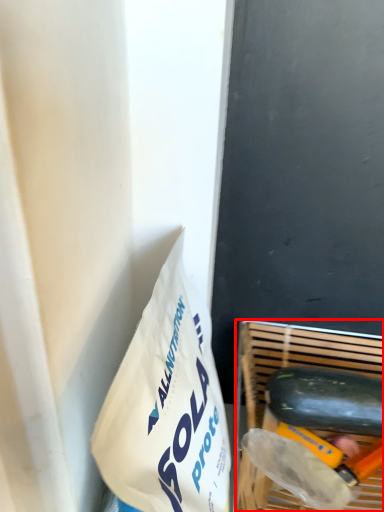
Question: From the image's perspective, considering the relative positions of basket (annotated by the red box) and cucumber in the image provided, where is basket (annotated by the red box) located with respect to the staircase?

Choices:
 (A) above
 (B) below

Answer: (B)